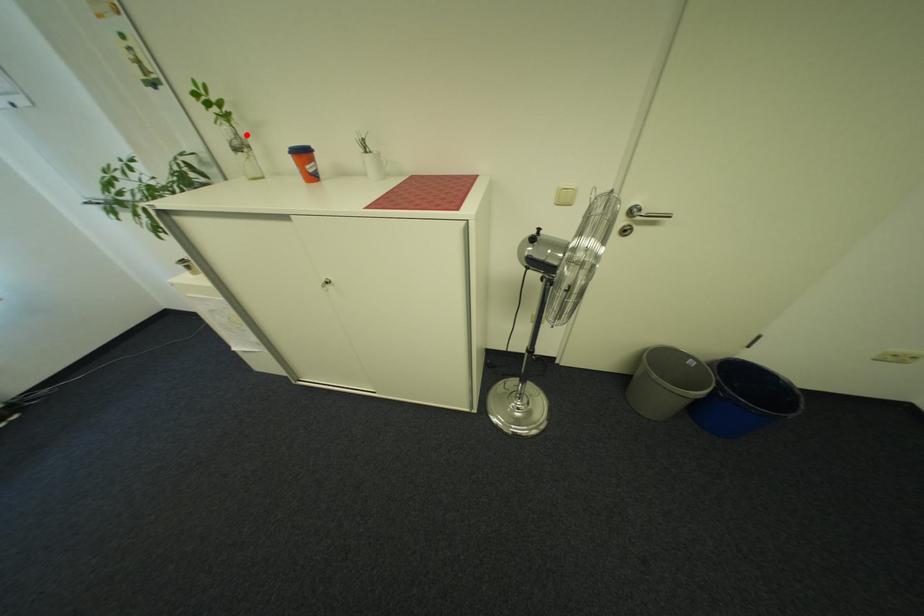
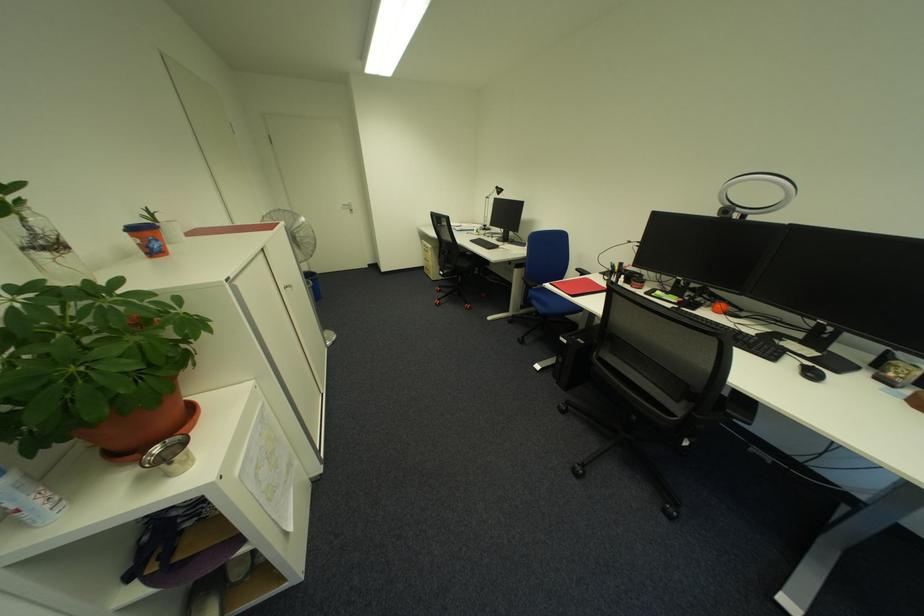
Question: A red point is marked in image1. In image2, is the corresponding 3D point closer to the camera or farther? Reply with the corresponding letter.

Choices:
 (A) The corresponding 3D point is closer.
 (B) The corresponding 3D point is farther.

Answer: (B)